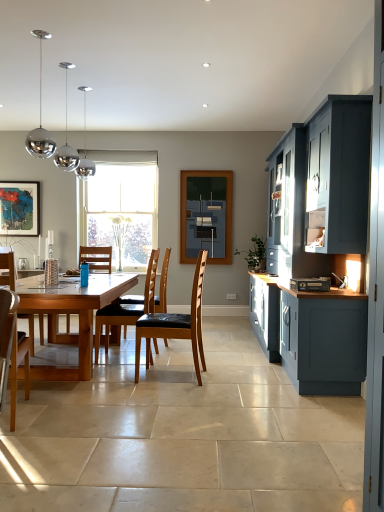
Question: Could you tell me if matte black picture frame at upper left is turned towards brown leather chair at center, marked as the 2th chair in a front-to-back arrangement?

Choices:
 (A) yes
 (B) no

Answer: (B)

Question: Considering the relative positions of matte black picture frame at upper left and brown leather chair at center, the 1th chair viewed from the right, in the image provided, is matte black picture frame at upper left behind brown leather chair at center, the 1th chair viewed from the right,?

Choices:
 (A) no
 (B) yes

Answer: (B)

Question: From the image's perspective, is matte black picture frame at upper left below brown leather chair at center, placed as the second chair when sorted from back to front?

Choices:
 (A) yes
 (B) no

Answer: (B)

Question: From the image's perspective, does matte black picture frame at upper left appear higher than brown leather chair at center, marked as the 2th chair in a front-to-back arrangement?

Choices:
 (A) no
 (B) yes

Answer: (B)

Question: Would you say matte black picture frame at upper left contains brown leather chair at center, the 3th chair when ordered from left to right?

Choices:
 (A) no
 (B) yes

Answer: (A)

Question: Is matte black picture frame at upper left in front of brown leather chair at center, the 3th chair when ordered from left to right?

Choices:
 (A) no
 (B) yes

Answer: (A)

Question: Can you confirm if brown leather chair at center is bigger than matte blue cabinet at right?

Choices:
 (A) yes
 (B) no

Answer: (B)

Question: Is brown leather chair at center thinner than matte blue cabinet at right?

Choices:
 (A) no
 (B) yes

Answer: (B)

Question: Is brown leather chair at center closer to camera compared to matte blue cabinet at right?

Choices:
 (A) no
 (B) yes

Answer: (A)

Question: Is brown leather chair at center next to matte blue cabinet at right?

Choices:
 (A) yes
 (B) no

Answer: (B)

Question: From a real-world perspective, is brown leather chair at center positioned under matte blue cabinet at right based on gravity?

Choices:
 (A) no
 (B) yes

Answer: (B)

Question: Is brown leather chair at center smaller than matte blue cabinet at right?

Choices:
 (A) yes
 (B) no

Answer: (A)

Question: Considering the relative positions of natural wood table at center and matte black painting at center in the image provided, is natural wood table at center to the left of matte black painting at center from the viewer's perspective?

Choices:
 (A) no
 (B) yes

Answer: (B)